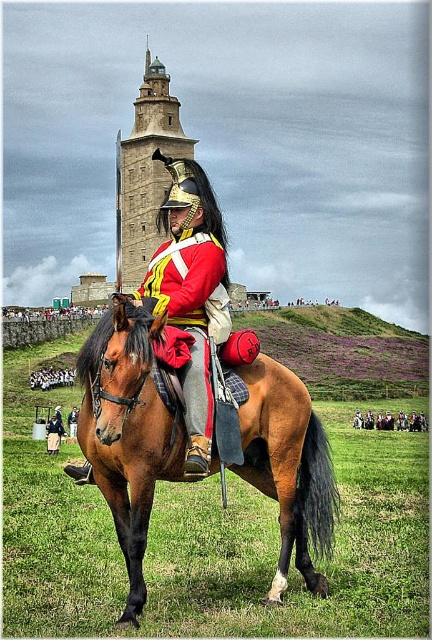
You are a costume designer examining the historical reenactment scene. You notice two coats labeled as the same item in the inventory but with different descriptions. The red woolen coat at center and the shiny red coat at center. Which one is bigger?

The red woolen coat at center is larger in size compared to the shiny red coat at center.

You are a photographer trying to capture the red woolen coat at center in your shot. Based on its coordinates, where should you position your camera to ensure it is centered in the frame?

The red woolen coat at center is located at point coordinates (374, 420), so you should position your camera to focus on those coordinates to center it in the frame.

You are a photographer positioned at point (x=190, y=291) in the scene. You want to capture a closeup of the shiny red uniform at center. Is the point you are standing at the correct location to focus on the shiny red uniform at center?

Yes, the shiny red uniform at center is located at point (x=190, y=291), so standing at that point would allow you to focus on the shiny red uniform at center for a closeup.